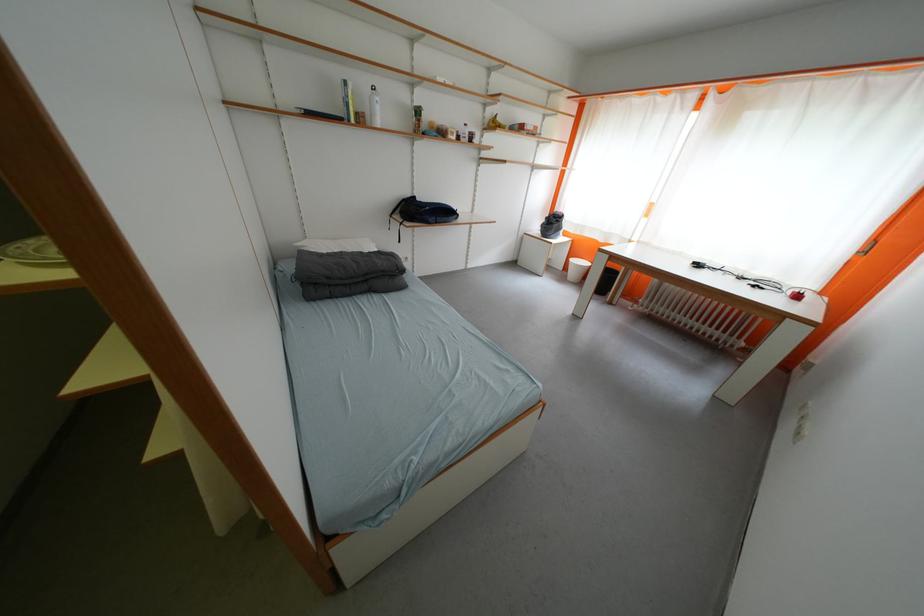
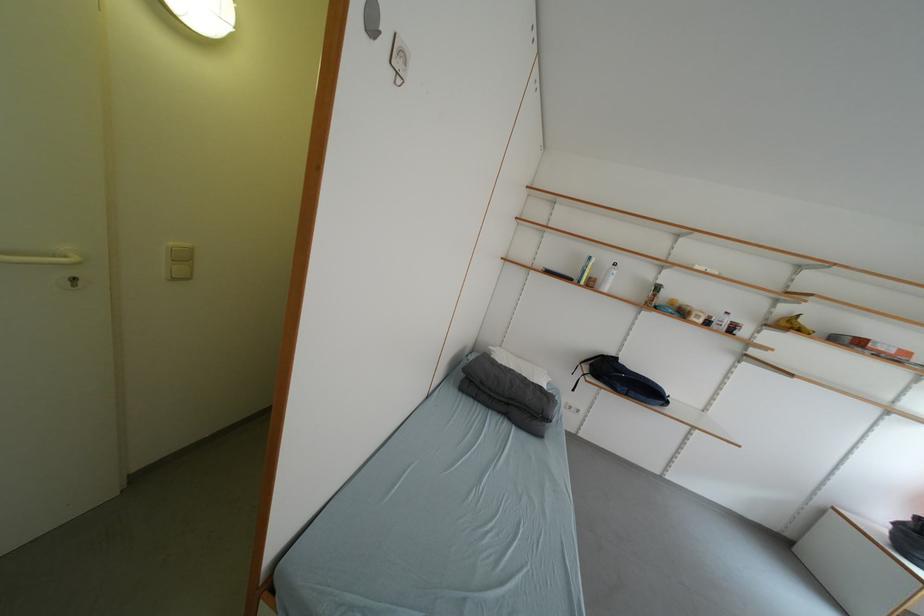
Locate, in the second image, the point that corresponds to (x=503, y=128) in the first image.

(797, 328)